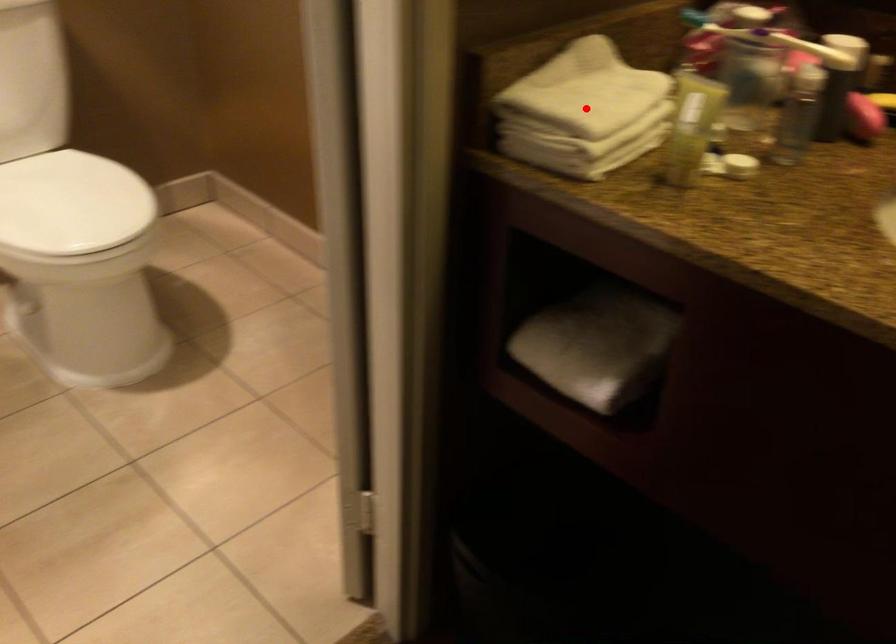
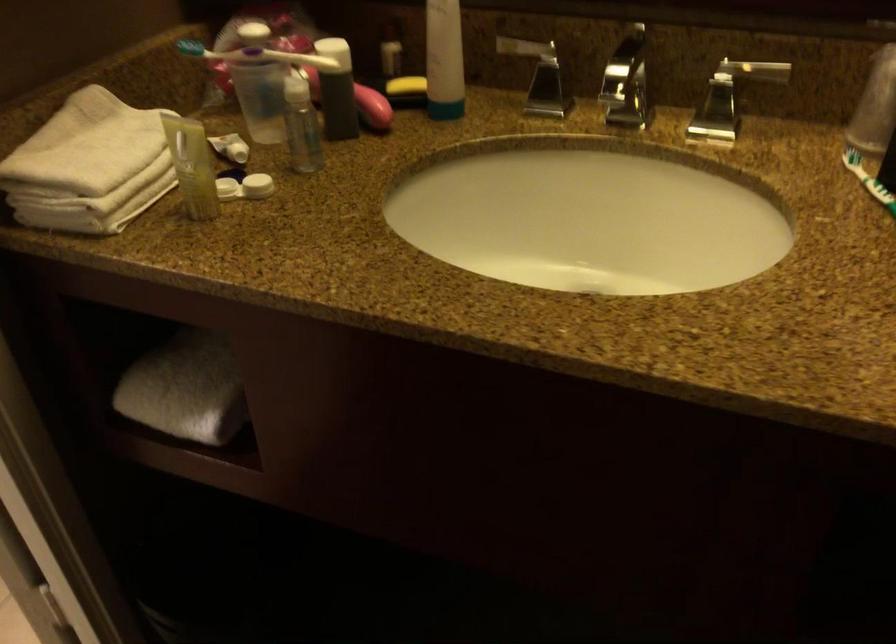
In the second image, find the point that corresponds to the highlighted location in the first image.

(89, 166)